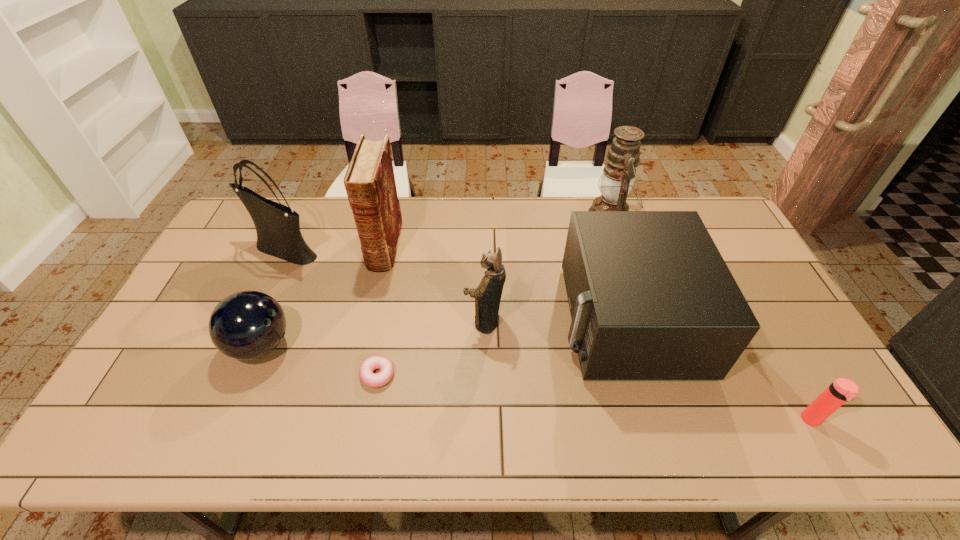
At what (x,y) coordinates should I click in order to perform the action: click on lantern. Please return your answer as a coordinate pair (x, y). The width and height of the screenshot is (960, 540). Looking at the image, I should click on (622, 158).

Where is `hardback book`? The height and width of the screenshot is (540, 960). hardback book is located at coordinates (369, 181).

Identify the location of shoulder bag. This screenshot has width=960, height=540. (277, 226).

The image size is (960, 540). Find the location of `the fifth object from left to right`. the fifth object from left to right is located at coordinates (487, 295).

Locate an element on the screen. Image resolution: width=960 pixels, height=540 pixels. figurine is located at coordinates (487, 295).

What are the coordinates of `the fourth shortest object` in the screenshot? It's located at (651, 298).

The height and width of the screenshot is (540, 960). What are the coordinates of `bowling ball` in the screenshot? It's located at (246, 325).

The width and height of the screenshot is (960, 540). What are the coordinates of `the nearest object` in the screenshot? It's located at (842, 390).

The image size is (960, 540). Find the location of `the rightmost object`. the rightmost object is located at coordinates (842, 390).

This screenshot has height=540, width=960. I want to click on doughnut, so click(x=366, y=374).